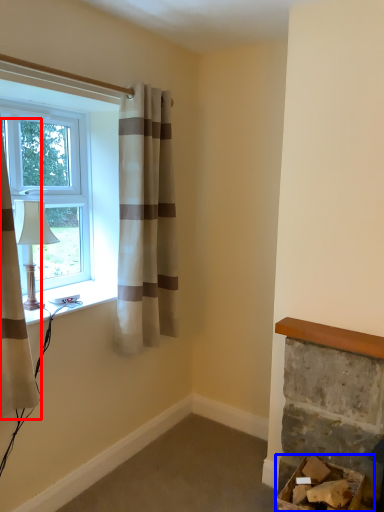
Question: Among these objects, which one is farthest to the camera, curtain (highlighted by a red box) or furniture (highlighted by a blue box)?

Choices:
 (A) curtain
 (B) furniture

Answer: (B)